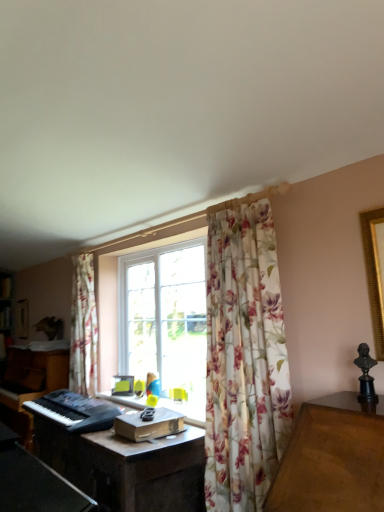
Question: From the image's perspective, would you say dark brown wooden computer desk at center is positioned over floral fabric curtain at center?

Choices:
 (A) no
 (B) yes

Answer: (A)

Question: Does dark brown wooden computer desk at center have a lesser width compared to floral fabric curtain at center?

Choices:
 (A) yes
 (B) no

Answer: (B)

Question: From a real-world perspective, is dark brown wooden computer desk at center located higher than floral fabric curtain at center?

Choices:
 (A) yes
 (B) no

Answer: (B)

Question: From the image's perspective, is dark brown wooden computer desk at center below floral fabric curtain at center?

Choices:
 (A) yes
 (B) no

Answer: (A)

Question: Is dark brown wooden computer desk at center in front of floral fabric curtain at center?

Choices:
 (A) no
 (B) yes

Answer: (A)

Question: Considering their positions, is floral fabric curtain at left located in front of or behind dark brown wooden computer desk at center?

Choices:
 (A) behind
 (B) front

Answer: (A)

Question: In the image, is floral fabric curtain at left on the left side or the right side of dark brown wooden computer desk at center?

Choices:
 (A) right
 (B) left

Answer: (B)

Question: Is floral fabric curtain at left wider or thinner than dark brown wooden computer desk at center?

Choices:
 (A) thin
 (B) wide

Answer: (A)

Question: Is floral fabric curtain at left inside or outside of dark brown wooden computer desk at center?

Choices:
 (A) outside
 (B) inside

Answer: (A)

Question: From their relative heights in the image, would you say floral fabric curtain at left is taller or shorter than floral fabric curtain at center?

Choices:
 (A) short
 (B) tall

Answer: (A)

Question: Looking at their shapes, would you say floral fabric curtain at left is wider or thinner than floral fabric curtain at center?

Choices:
 (A) wide
 (B) thin

Answer: (B)

Question: Visually, is floral fabric curtain at left positioned to the left or to the right of floral fabric curtain at center?

Choices:
 (A) right
 (B) left

Answer: (B)

Question: Does point coord(74,366) appear closer or farther from the camera than point coord(279,307)?

Choices:
 (A) closer
 (B) farther

Answer: (B)

Question: Is point (249, 297) positioned closer to the camera than point (124, 466)?

Choices:
 (A) closer
 (B) farther

Answer: (B)

Question: Is floral fabric curtain at center bigger or smaller than dark brown wooden computer desk at center?

Choices:
 (A) small
 (B) big

Answer: (A)